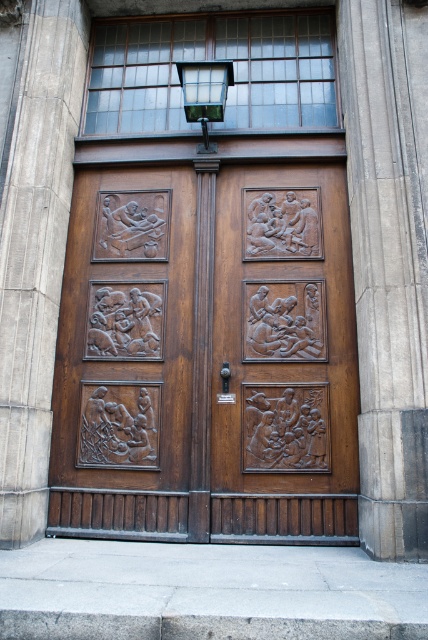
Question: Does polished wood carving at center have a larger size compared to gray stone pillar at center?

Choices:
 (A) no
 (B) yes

Answer: (A)

Question: Which is nearer to the gray stone pillar at center?

Choices:
 (A) matte wood door at center
 (B) smooth stone pillar at left
 (C) polished wood carving at center

Answer: (C)

Question: Can you confirm if matte wood door at center is positioned to the right of smooth stone pillar at left?

Choices:
 (A) no
 (B) yes

Answer: (B)

Question: Considering the relative positions of polished wood carving at center and gray stone pillar at center in the image provided, where is polished wood carving at center located with respect to gray stone pillar at center?

Choices:
 (A) left
 (B) right

Answer: (A)

Question: Which object is the closest to the gray stone pillar at center?

Choices:
 (A) polished wood carving at center
 (B) matte wood door at center

Answer: (A)

Question: Considering the real-world distances, which object is closest to the polished wood carving at center?

Choices:
 (A) matte wood door at center
 (B) smooth stone pillar at left

Answer: (A)